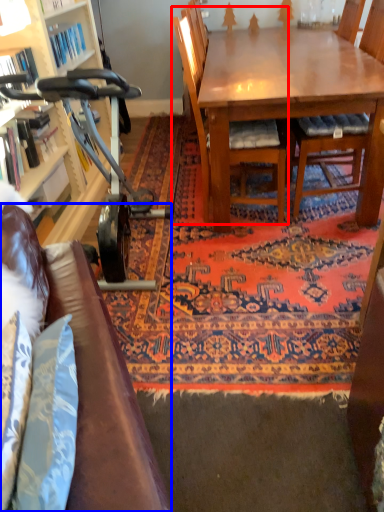
Question: Which object appears closest to the camera in this image, chair (highlighted by a red box) or studio couch (highlighted by a blue box)?

Choices:
 (A) chair
 (B) studio couch

Answer: (B)